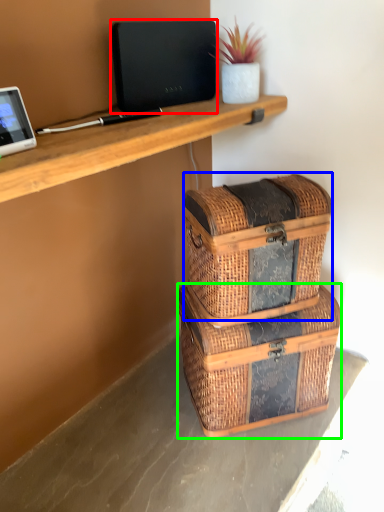
Question: Estimate the real-world distances between objects in this image. Which object is closer to laptop (highlighted by a red box), storage box (highlighted by a blue box) or storage box (highlighted by a green box)?

Choices:
 (A) storage box
 (B) storage box

Answer: (A)